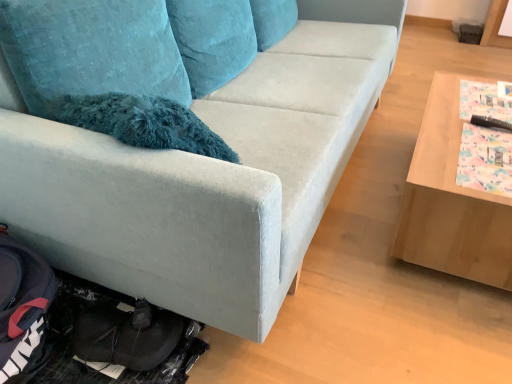
Question: From a real-world perspective, is velvet blue couch at center on light brown wooden table at right?

Choices:
 (A) no
 (B) yes

Answer: (B)

Question: Is velvet blue couch at center oriented away from light brown wooden table at right?

Choices:
 (A) yes
 (B) no

Answer: (B)

Question: Does velvet blue couch at center appear on the right side of light brown wooden table at right?

Choices:
 (A) yes
 (B) no

Answer: (B)

Question: From a real-world perspective, is velvet blue couch at center beneath light brown wooden table at right?

Choices:
 (A) no
 (B) yes

Answer: (A)

Question: Does velvet blue couch at center have a smaller size compared to light brown wooden table at right?

Choices:
 (A) no
 (B) yes

Answer: (A)

Question: Is velvet blue couch at center bigger than light brown wooden table at right?

Choices:
 (A) yes
 (B) no

Answer: (A)

Question: Considering the relative positions of light brown wooden table at right and velvet blue couch at center in the image provided, is light brown wooden table at right to the left of velvet blue couch at center from the viewer's perspective?

Choices:
 (A) no
 (B) yes

Answer: (A)

Question: Is light brown wooden table at right to the right of velvet blue couch at center from the viewer's perspective?

Choices:
 (A) yes
 (B) no

Answer: (A)

Question: From a real-world perspective, is light brown wooden table at right on velvet blue couch at center?

Choices:
 (A) yes
 (B) no

Answer: (B)

Question: Is light brown wooden table at right facing towards velvet blue couch at center?

Choices:
 (A) yes
 (B) no

Answer: (B)

Question: Can you confirm if light brown wooden table at right is bigger than velvet blue couch at center?

Choices:
 (A) no
 (B) yes

Answer: (A)

Question: Does light brown wooden table at right have a lesser height compared to velvet blue couch at center?

Choices:
 (A) no
 (B) yes

Answer: (B)

Question: From the image's perspective, is light brown wooden table at right located above or below velvet blue couch at center?

Choices:
 (A) above
 (B) below

Answer: (B)